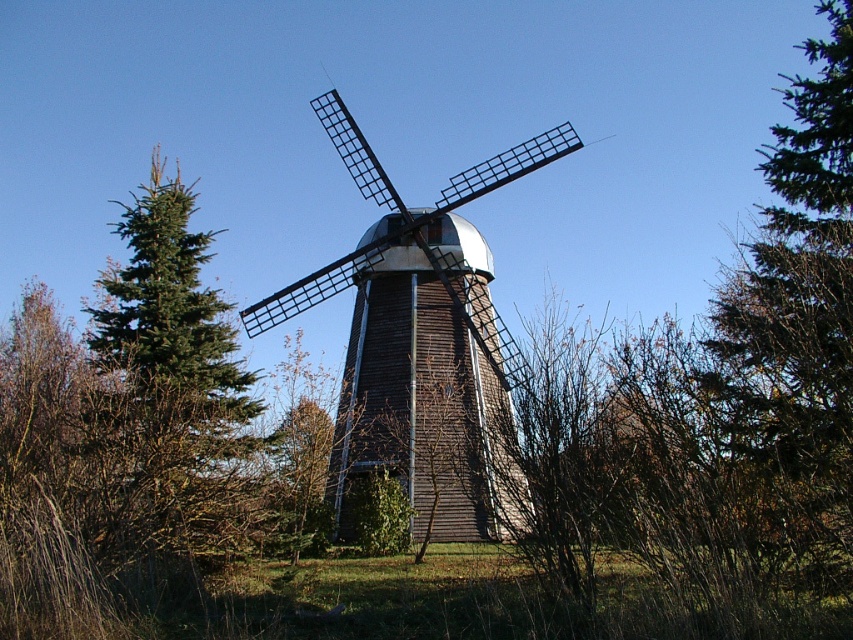
Question: Which point is closer to the camera?

Choices:
 (A) green grass at center
 (B) green needle-like tree at left
 (C) brown wooden windmill at center

Answer: (A)

Question: Does brown wooden windmill at center appear on the left side of green needle-like tree at left?

Choices:
 (A) yes
 (B) no

Answer: (B)

Question: Which point is closer to the camera taking this photo?

Choices:
 (A) (563, 618)
 (B) (196, 307)
 (C) (347, 353)

Answer: (A)

Question: Is brown wooden windmill at center wider than green grass at center?

Choices:
 (A) yes
 (B) no

Answer: (B)

Question: Considering the relative positions of brown wooden windmill at center and green needle-like tree at left in the image provided, where is brown wooden windmill at center located with respect to green needle-like tree at left?

Choices:
 (A) right
 (B) left

Answer: (A)

Question: Considering the real-world distances, which object is closest to the brown wooden windmill at center?

Choices:
 (A) green needle-like tree at left
 (B) green grass at center

Answer: (A)